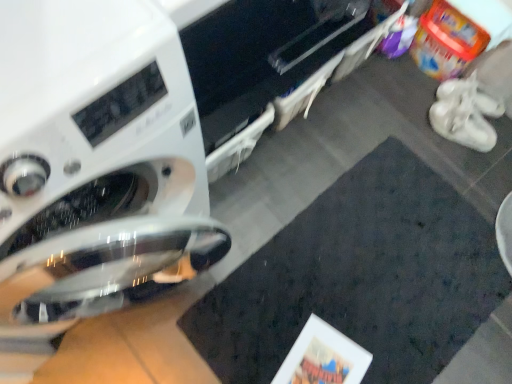
Question: Is white suede sneakers at right wider than dark matte mat at center?

Choices:
 (A) yes
 (B) no

Answer: (B)

Question: Does white suede sneakers at right have a smaller size compared to dark matte mat at center?

Choices:
 (A) no
 (B) yes

Answer: (B)

Question: Is white suede sneakers at right shorter than dark matte mat at center?

Choices:
 (A) no
 (B) yes

Answer: (A)

Question: Is white suede sneakers at right looking in the opposite direction of dark matte mat at center?

Choices:
 (A) yes
 (B) no

Answer: (B)

Question: Does white suede sneakers at right have a larger size compared to dark matte mat at center?

Choices:
 (A) no
 (B) yes

Answer: (A)

Question: Does white suede sneakers at right have a greater height compared to dark matte mat at center?

Choices:
 (A) no
 (B) yes

Answer: (B)

Question: Is white glossy washing machine at left not within white suede sneakers at right?

Choices:
 (A) yes
 (B) no

Answer: (A)

Question: Considering the relative positions of white glossy washing machine at left and white suede sneakers at right in the image provided, is white glossy washing machine at left to the right of white suede sneakers at right from the viewer's perspective?

Choices:
 (A) no
 (B) yes

Answer: (A)

Question: Would you say white glossy washing machine at left is a long distance from white suede sneakers at right?

Choices:
 (A) yes
 (B) no

Answer: (A)

Question: Does white glossy washing machine at left have a greater width compared to white suede sneakers at right?

Choices:
 (A) no
 (B) yes

Answer: (B)

Question: From a real-world perspective, is white glossy washing machine at left located higher than white suede sneakers at right?

Choices:
 (A) no
 (B) yes

Answer: (B)

Question: Is white suede sneakers at right at the back of white glossy washing machine at left?

Choices:
 (A) no
 (B) yes

Answer: (A)

Question: Is the surface of white matte shoe at right in direct contact with dark matte mat at center?

Choices:
 (A) yes
 (B) no

Answer: (B)